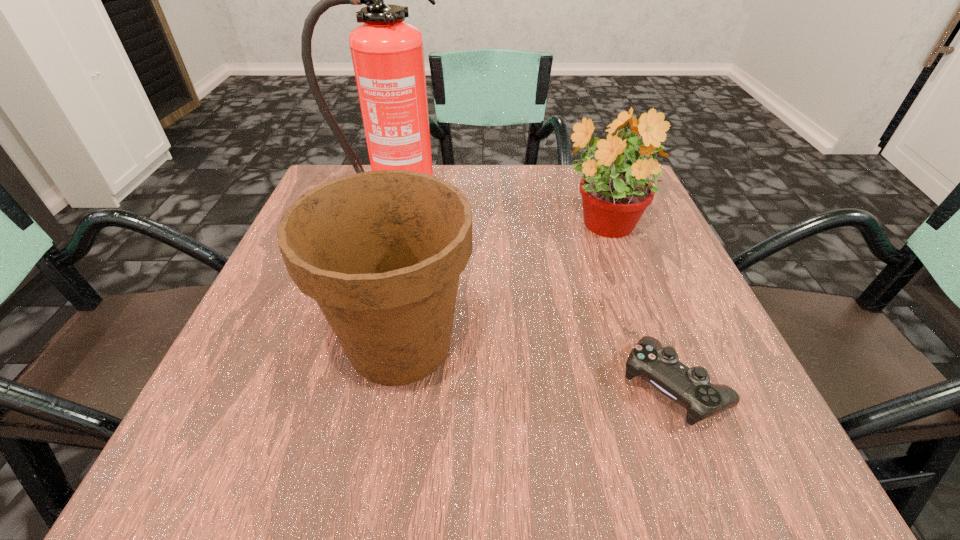
Image resolution: width=960 pixels, height=540 pixels. Find the location of `vacant space at the left edge`. vacant space at the left edge is located at coordinates (325, 329).

Image resolution: width=960 pixels, height=540 pixels. In order to click on free space at the right edge of the desktop in this screenshot , I will do (653, 287).

Locate an element on the screen. free space at the near right corner of the desktop is located at coordinates (646, 424).

At what (x,y) coordinates should I click in order to perform the action: click on empty space between the control and the left flowerpot. Please return your answer as a coordinate pair (x, y). Looking at the image, I should click on (537, 365).

Identify the location of free space between the farther flowerpot and the shortest object. (637, 306).

Identify the location of free space between the shortest object and the farther flowerpot. The width and height of the screenshot is (960, 540). (637, 306).

Locate an element on the screen. vacant area that lies between the fire extinguisher and the farther flowerpot is located at coordinates (497, 217).

Locate an element on the screen. The width and height of the screenshot is (960, 540). free point between the right flowerpot and the tallest object is located at coordinates (497, 217).

Where is `free space between the fire extinguisher and the right flowerpot`? The image size is (960, 540). free space between the fire extinguisher and the right flowerpot is located at coordinates (497, 217).

Locate an element on the screen. This screenshot has height=540, width=960. vacant space that's between the right flowerpot and the nearer flowerpot is located at coordinates pyautogui.click(x=501, y=285).